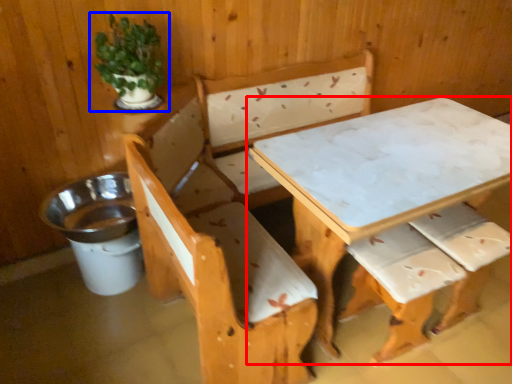
Question: Among these objects, which one is nearest to the camera, table (highlighted by a red box) or houseplant (highlighted by a blue box)?

Choices:
 (A) table
 (B) houseplant

Answer: (A)